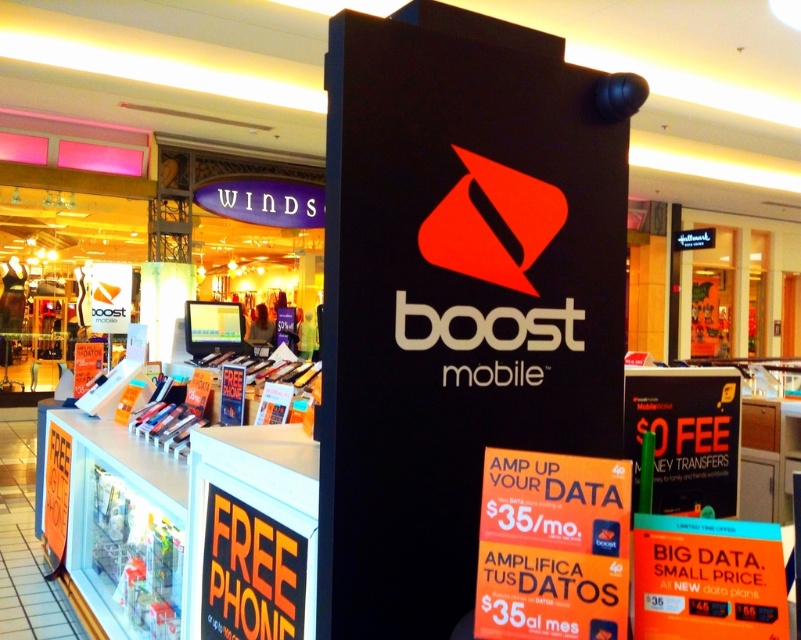
Question: Which point is farther to the camera?

Choices:
 (A) matte black sign at center
 (B) black matte sign at center
 (C) orange paper at center

Answer: (A)

Question: Is black matte sign at center to the left of orangetexturedsignage at lower left from the viewer's perspective?

Choices:
 (A) yes
 (B) no

Answer: (B)

Question: Can you confirm if orange paper at center is wider than orangetexturedsignage at lower left?

Choices:
 (A) no
 (B) yes

Answer: (A)

Question: Which object is positioned farthest from the matte black sign at center?

Choices:
 (A) black matte sign at center
 (B) orangetexturedsignage at lower left
 (C) orange paper at center
 (D) orange paper sign at center

Answer: (B)

Question: Can you confirm if orange paper at center is wider than matte black sign at center?

Choices:
 (A) no
 (B) yes

Answer: (A)

Question: Which point is closer to the camera?

Choices:
 (A) orangetexturedsignage at lower left
 (B) orange paper at center

Answer: (B)